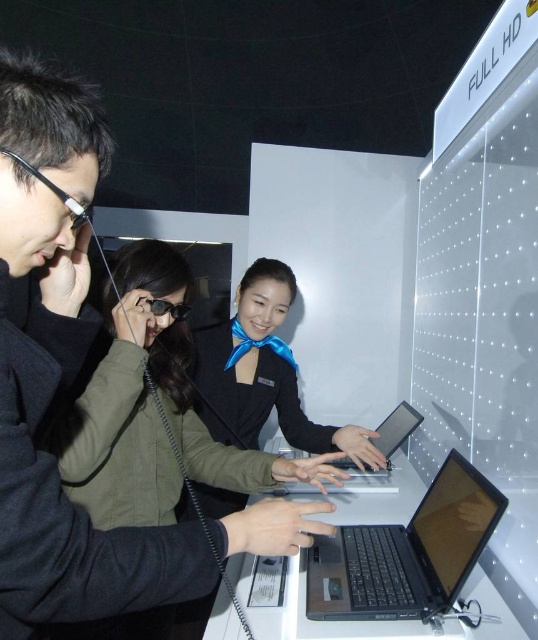
Where is `black fabric uniform at center`? The image size is (538, 640). black fabric uniform at center is located at coordinates (264, 374).

Is point (266, 323) positioned in front of point (348, 483)?

Yes, point (266, 323) is in front of point (348, 483).

Measure the distance between black fabric uniform at center and camera.

They are 4.69 feet apart.

At what (x,y) coordinates should I click in order to perform the action: click on black fabric uniform at center. Please return your answer as a coordinate pair (x, y). This screenshot has height=640, width=538. Looking at the image, I should click on (264, 374).

Is black matte laptop at center shorter than silver metallic laptop at center?

No, black matte laptop at center is not shorter than silver metallic laptop at center.

Who is more forward, [399,595] or [372,444]?

Point [399,595]

Between point (428, 586) and point (374, 440), which one is positioned in front?

Positioned in front is point (428, 586).

Identify the location of black matte laptop at center. (407, 554).

Who is taller, matte black laptop at center or satin black tablet at center?

Standing taller between the two is matte black laptop at center.

Is matte black laptop at center thinner than satin black tablet at center?

No.

Does point (259, 504) come in front of point (379, 445)?

Yes, point (259, 504) is closer to viewer.

You are a GUI agent. You are given a task and a screenshot of the screen. Output one action in this format:
    pyautogui.click(x=<x>, y=<y>)
    Task: Click on the matte black laptop at center
    
    Given the screenshot: What is the action you would take?
    pyautogui.click(x=60, y=376)